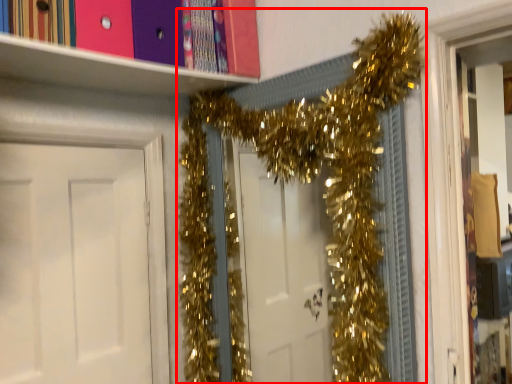
Question: Where is christmas decoration (annotated by the red box) located in relation to door in the image?

Choices:
 (A) left
 (B) right

Answer: (B)